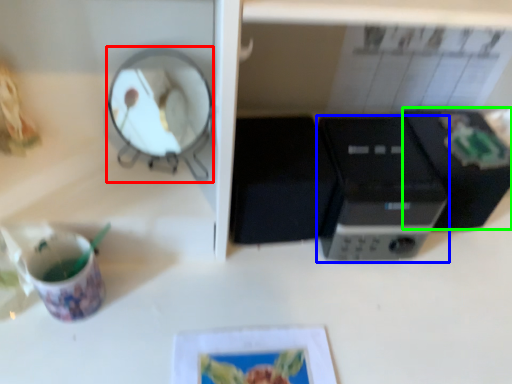
Question: Which is farther away from mirror (highlighted by a red box)? home appliance (highlighted by a blue box) or appliance (highlighted by a green box)?

Choices:
 (A) home appliance
 (B) appliance

Answer: (B)